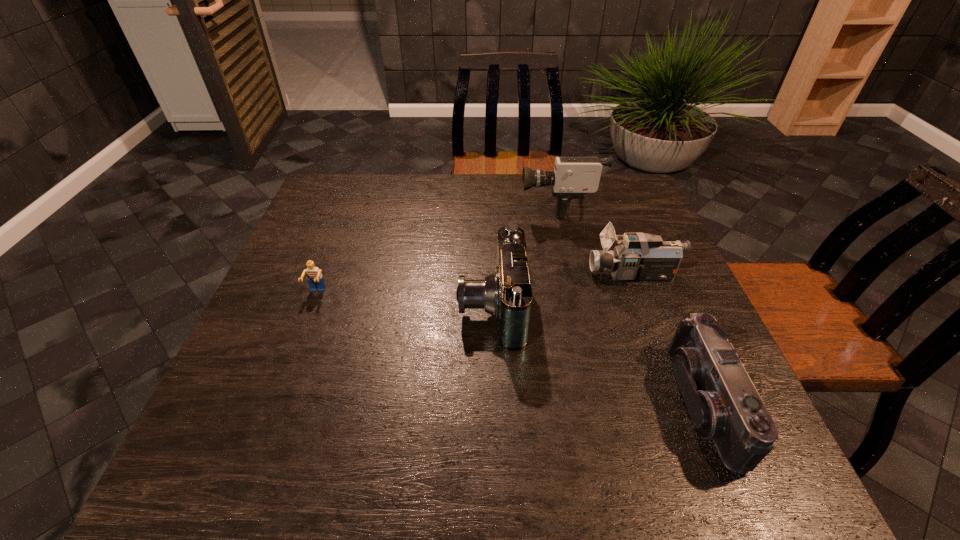
In the image, there is a desktop. Where is `vacant space at the right edge`? vacant space at the right edge is located at coordinates (649, 341).

Locate an element on the screen. The height and width of the screenshot is (540, 960). vacant space at the far left corner of the desktop is located at coordinates (352, 206).

At what (x,y) coordinates should I click in order to perform the action: click on free space at the far right corner of the desktop. Please return your answer as a coordinate pair (x, y). Looking at the image, I should click on (632, 190).

In the image, there is a desktop. At what (x,y) coordinates should I click in order to perform the action: click on vacant space at the near right corner. Please return your answer as a coordinate pair (x, y). The width and height of the screenshot is (960, 540). Looking at the image, I should click on (748, 485).

At what (x,y) coordinates should I click in order to perform the action: click on free point between the leftmost object and the leftmost camcorder. Please return your answer as a coordinate pair (x, y). The image size is (960, 540). Looking at the image, I should click on (404, 299).

Locate an element on the screen. Image resolution: width=960 pixels, height=540 pixels. vacant point located between the tallest object and the shortest object is located at coordinates (438, 249).

Where is `empty space that is in between the tallest camcorder and the Lego`? empty space that is in between the tallest camcorder and the Lego is located at coordinates (438, 249).

Where is `the third closest object to the leftmost camcorder`? This screenshot has width=960, height=540. the third closest object to the leftmost camcorder is located at coordinates (723, 404).

This screenshot has width=960, height=540. In order to click on the second closest object to the farthest camcorder in this screenshot , I will do `click(506, 294)`.

What are the coordinates of `camcorder object that ranks as the closest to the Lego` in the screenshot? It's located at (506, 294).